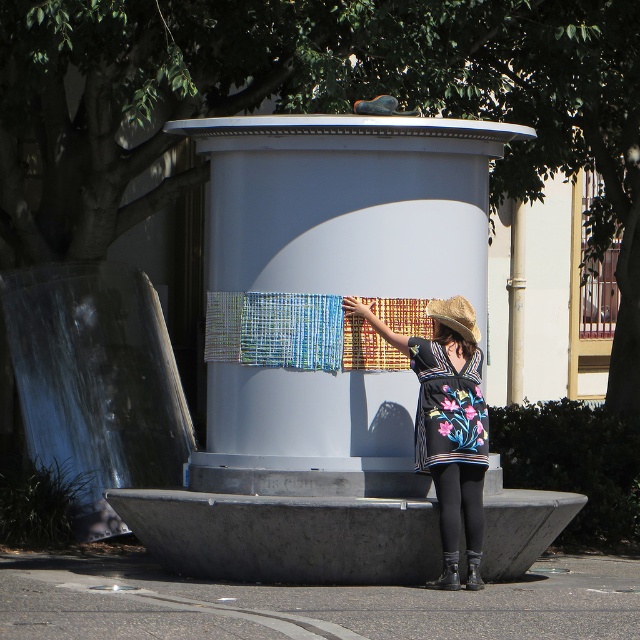
Question: Which is nearer to the floral dress at center?

Choices:
 (A) white matte pillar at center
 (B) black tights at lower center
 (C) strawmaterial/texturehat at upper center

Answer: (B)

Question: Can you confirm if white matte pillar at center is wider than floral dress at center?

Choices:
 (A) yes
 (B) no

Answer: (A)

Question: Based on their relative distances, which object is farther from the floral dress at center?

Choices:
 (A) black leather boot at lower right
 (B) strawmaterial/texturehat at upper center
 (C) white matte pillar at center

Answer: (C)

Question: From the image, what is the correct spatial relationship of floral embroidered dress at center in relation to leather boot at lower center?

Choices:
 (A) below
 (B) above

Answer: (B)

Question: Which point is closer to the camera?

Choices:
 (A) [401, 268]
 (B) [314, 353]

Answer: (B)

Question: In this image, where is white matte pillar at center located relative to textured woven cloth at center?

Choices:
 (A) below
 (B) above

Answer: (B)